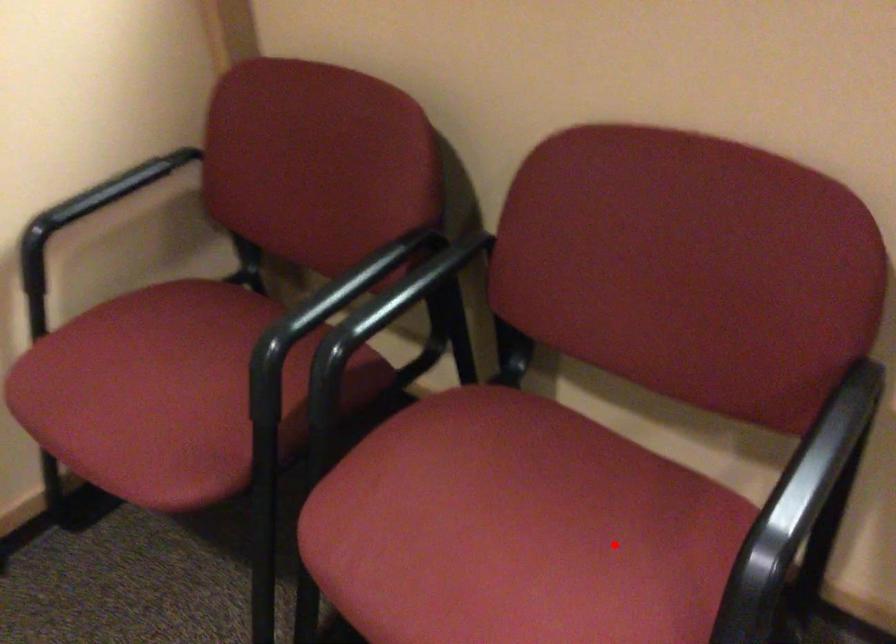
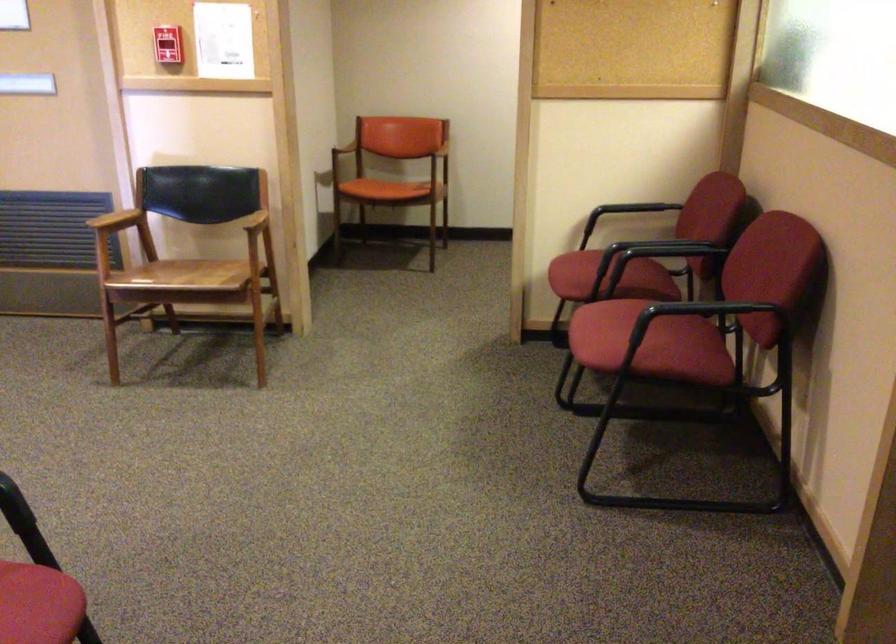
Question: I am providing you with two images of the same scene from different viewpoints. A red point is marked on the first image. Is the red point's position out of view in image 2?

Choices:
 (A) Yes
 (B) No

Answer: (B)